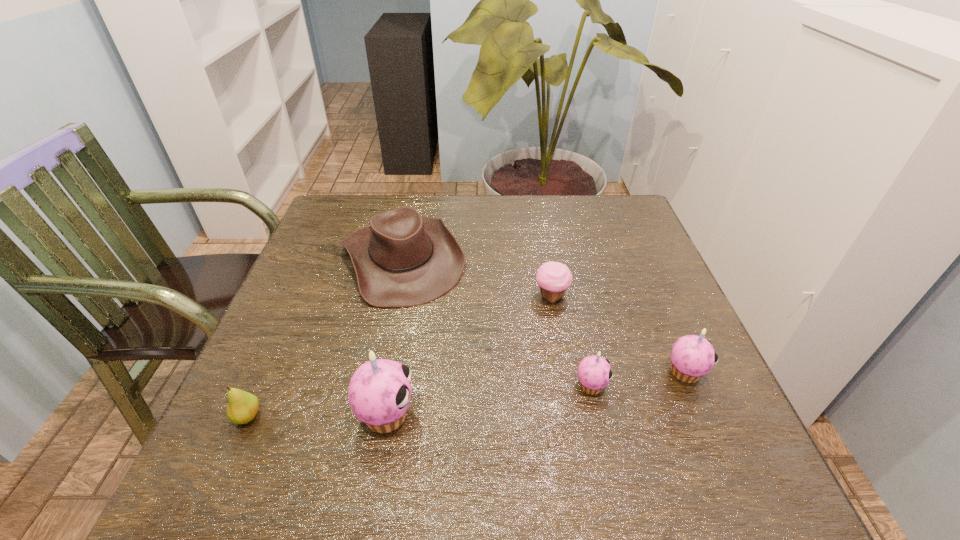
Where is `free space located on the right of the pear`? free space located on the right of the pear is located at coordinates [x=378, y=416].

Identify the location of object present at the far edge. (402, 259).

This screenshot has width=960, height=540. Find the location of `pear that is positioned at the near edge`. pear that is positioned at the near edge is located at coordinates (243, 406).

Find the location of a particular element. cowboy hat situated at the left edge is located at coordinates (402, 259).

You are a GUI agent. You are given a task and a screenshot of the screen. Output one action in this format:
    pyautogui.click(x=<x>, y=<y>)
    Task: Click on the pear located in the left edge section of the desktop
    The height and width of the screenshot is (540, 960).
    Given the screenshot: What is the action you would take?
    pyautogui.click(x=243, y=406)

Where is `object located at the right edge`? The height and width of the screenshot is (540, 960). object located at the right edge is located at coordinates (692, 357).

Locate an element on the screen. The height and width of the screenshot is (540, 960). object present at the far left corner is located at coordinates (402, 259).

At what (x,y) coordinates should I click in order to perform the action: click on object at the near left corner. Please return your answer as a coordinate pair (x, y). The height and width of the screenshot is (540, 960). Looking at the image, I should click on (243, 406).

Locate an element on the screen. The height and width of the screenshot is (540, 960). vacant region at the far edge of the desktop is located at coordinates (444, 206).

In the image, there is a desktop. Where is `vacant space at the near edge`? This screenshot has width=960, height=540. vacant space at the near edge is located at coordinates (634, 423).